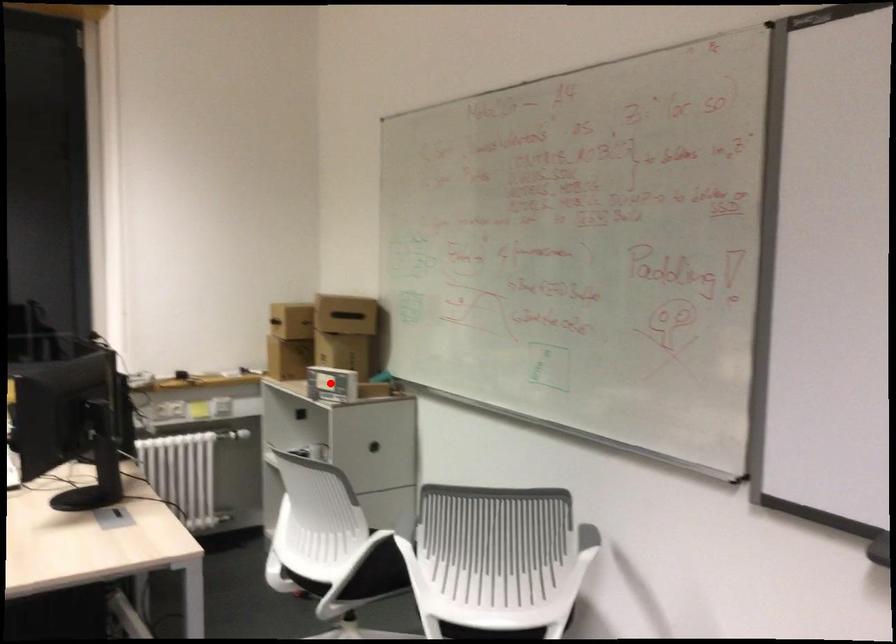
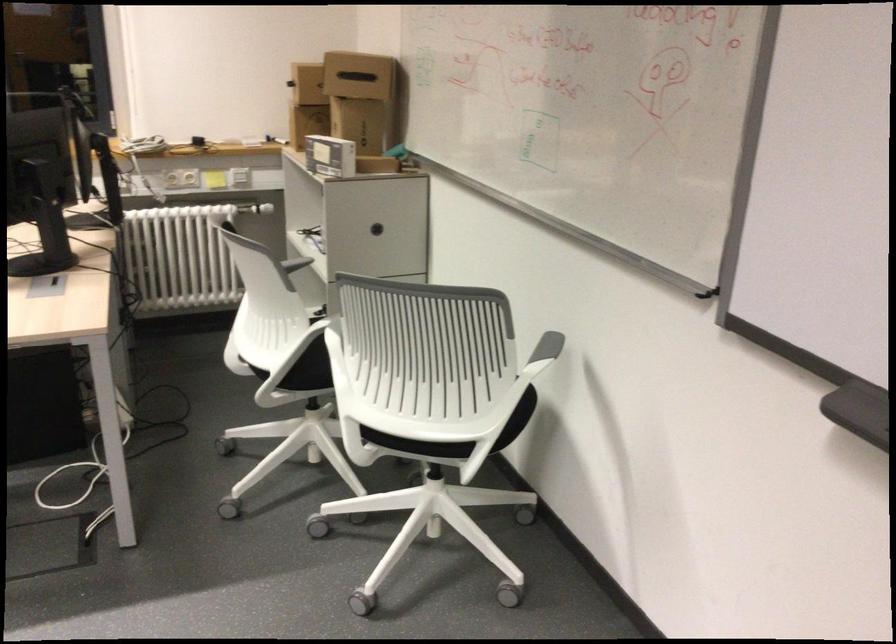
Question: I am providing you with two images of the same scene from different viewpoints. A red point is shown in image1. For the corresponding object point in image2, is it positioned nearer or farther from the camera?

Choices:
 (A) Nearer
 (B) Farther

Answer: (A)